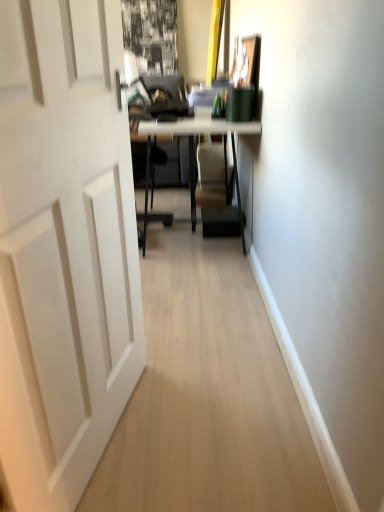
Identify the location of vacant space underneath white matte door at left (from a real-world perspective). This screenshot has height=512, width=384. (118, 431).